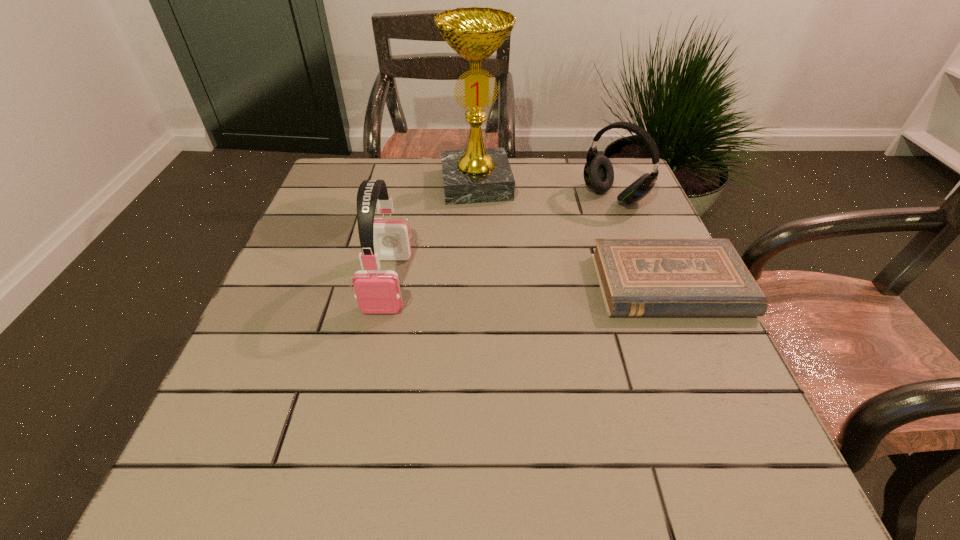
Locate an element on the screen. The width and height of the screenshot is (960, 540). vacant space on the desktop that is between the leftmost object and the shortest object and is positioned on the front-facing side of the third object from right to left is located at coordinates (495, 284).

Find the location of a particular element. Image resolution: width=960 pixels, height=540 pixels. vacant space on the desktop that is between the earphone and the Bible and is positioned on the ear cups of the headset is located at coordinates (497, 284).